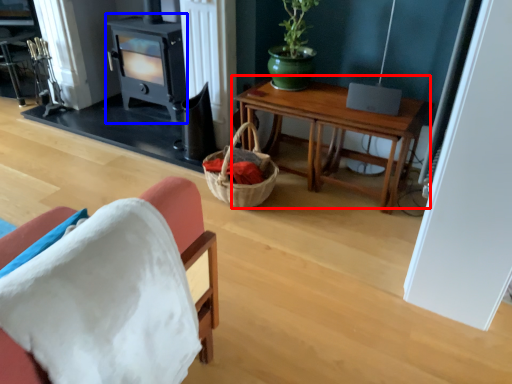
Question: Which of the following is the closest to the observer, table (highlighted by a red box) or fireplace (highlighted by a blue box)?

Choices:
 (A) table
 (B) fireplace

Answer: (A)